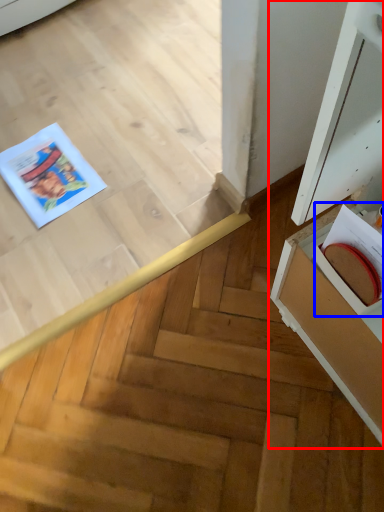
Question: Among these objects, which one is farthest to the camera, cabinetry (highlighted by a red box) or book (highlighted by a blue box)?

Choices:
 (A) cabinetry
 (B) book

Answer: (B)